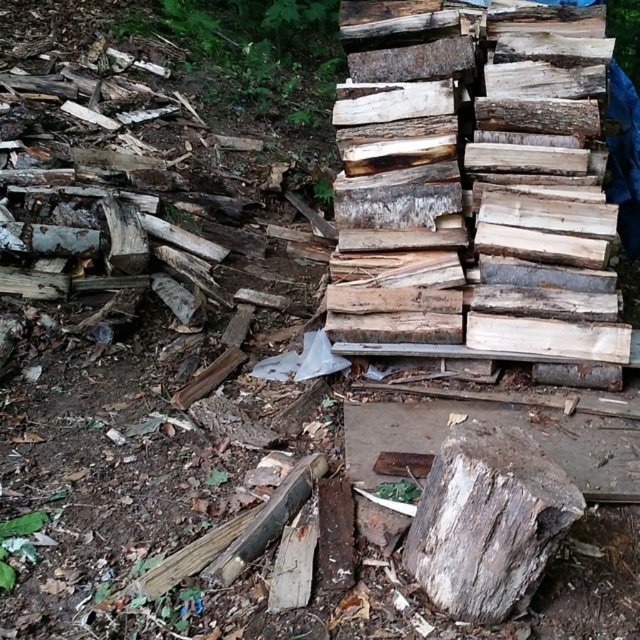
You are standing in front of the woodpile and want to place a new log at the same position as the weathered wood at upper right. According to the coordinates provided, where should you place it?

You should place the new log at the coordinates point (476, 184), which is where the weathered wood at upper right is located.

You are a hiker carrying a 3 meter long ladder. You need to place it between the weathered wood at upper right and the nearest object. Will the ladder be long enough to span the distance?

The distance between the weathered wood at upper right and the nearest object is 2.83 meters. Since the ladder is 3 meters long, it will be long enough to span the distance between the weathered wood at upper right and the nearest object.

You are an outdoor maintenance worker who needs to move the weathered wood at upper right and the weathered wood stump at center. Based on their positions, which object is located to the right of the other?

The weathered wood at upper right is positioned on the right side of weathered wood stump at center, so the weathered wood at upper right is to the right of the weathered wood stump at center.